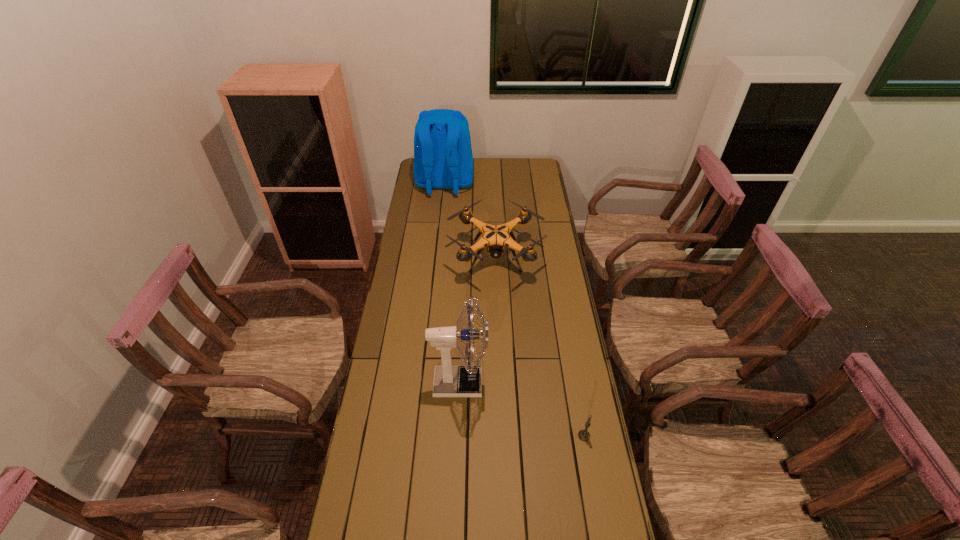
You are a GUI agent. You are given a task and a screenshot of the screen. Output one action in this format:
    pyautogui.click(x=<x>, y=<y>)
    Task: Click on the vacant space that satisfies the following two spatial constraints: 1. on the camera mount of the drone; 2. on the front-facing side of the fan
    
    Given the screenshot: What is the action you would take?
    pyautogui.click(x=500, y=383)

At what (x,y) coordinates should I click in order to perform the action: click on vacant space that satisfies the following two spatial constraints: 1. on the back of the rightmost object; 2. on the left side of the farthest object. Please return your answer as a coordinate pair (x, y). Looking at the image, I should click on (419, 436).

I want to click on free point that satisfies the following two spatial constraints: 1. on the front-facing side of the nearest object; 2. on the right side of the fan, so click(x=458, y=436).

This screenshot has width=960, height=540. Find the location of `vacant space that satisfies the following two spatial constraints: 1. on the camera mount of the rightmost object; 2. on the right side of the third nearest object`. vacant space that satisfies the following two spatial constraints: 1. on the camera mount of the rightmost object; 2. on the right side of the third nearest object is located at coordinates (502, 436).

At what (x,y) coordinates should I click in order to perform the action: click on vacant space that satisfies the following two spatial constraints: 1. on the camera mount of the shortest object; 2. on the left side of the drone. Please return your answer as a coordinate pair (x, y). This screenshot has width=960, height=540. Looking at the image, I should click on (502, 436).

This screenshot has width=960, height=540. In order to click on vacant position in the image that satisfies the following two spatial constraints: 1. on the front-facing side of the nearest object; 2. on the right side of the fan in this screenshot , I will do `click(458, 436)`.